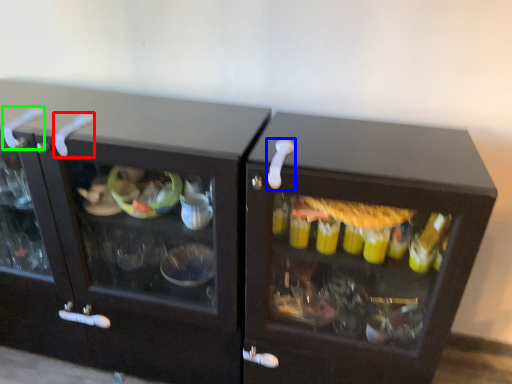
Question: Based on their relative distances, which object is farther from door handle (highlighted by a red box)? Choose from door handle (highlighted by a blue box) and door handle (highlighted by a green box).

Choices:
 (A) door handle
 (B) door handle

Answer: (A)